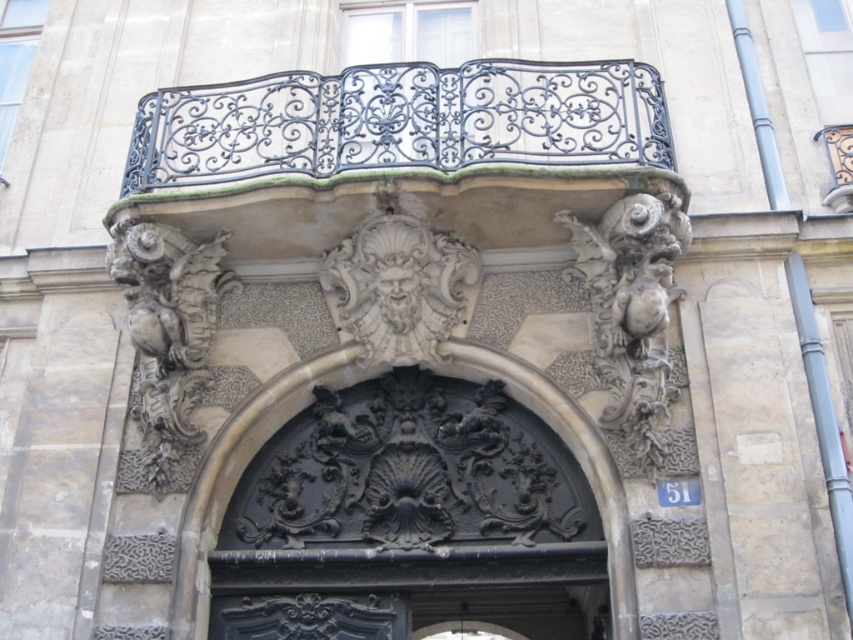
From the picture: You are an architect examining the building facade. You notice a specific point at coordinates (399, 122). What architectural element is located at this point?

The point at coordinates (399, 122) is occupied by the black wrought iron balcony at upper center.

You are standing in front of the building and want to touch both the black wrought iron door at center and the dark gray stone lion at center. Which one can you reach first without moving your position?

The black wrought iron door at center is closer to the viewer than the dark gray stone lion at center, so you can reach the black wrought iron door at center first without moving.

You are standing in front of the building and notice a specific point marked at coordinates point (198, 609). Given that the camera is positioned at ground level, can you estimate whether this point is within arm reach or requires a ladder to access?

The point (198, 609) is 41.69 meters away from the camera, which means it is too far to reach with an arm. A ladder would be necessary to access it.